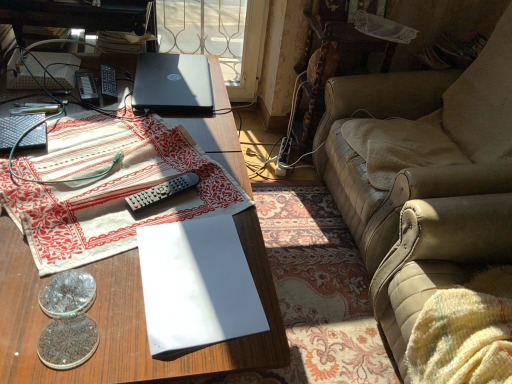
Locate an element on the screen. This screenshot has height=384, width=512. vacant area that is in front of gray plastic remote at center, the 3th remote control viewed from the back is located at coordinates (119, 243).